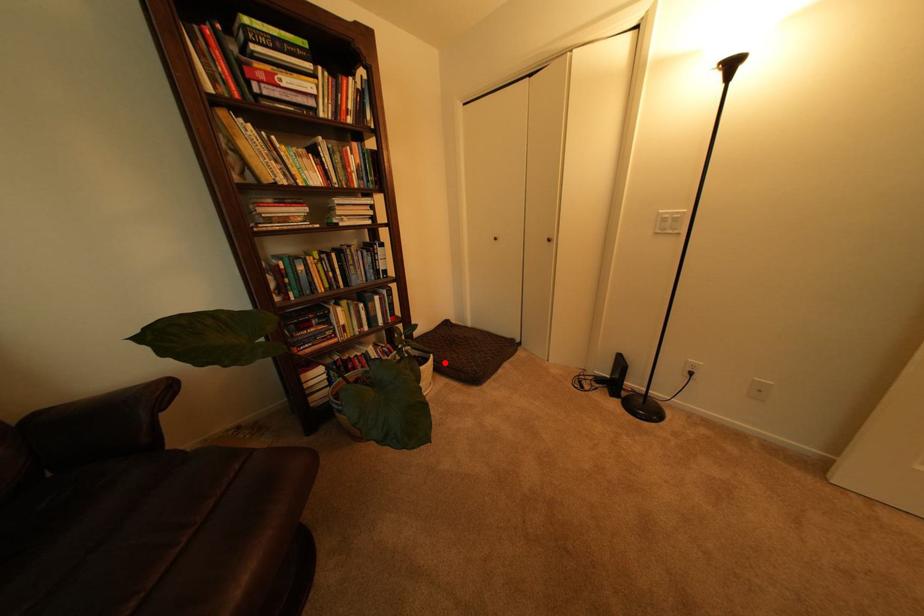
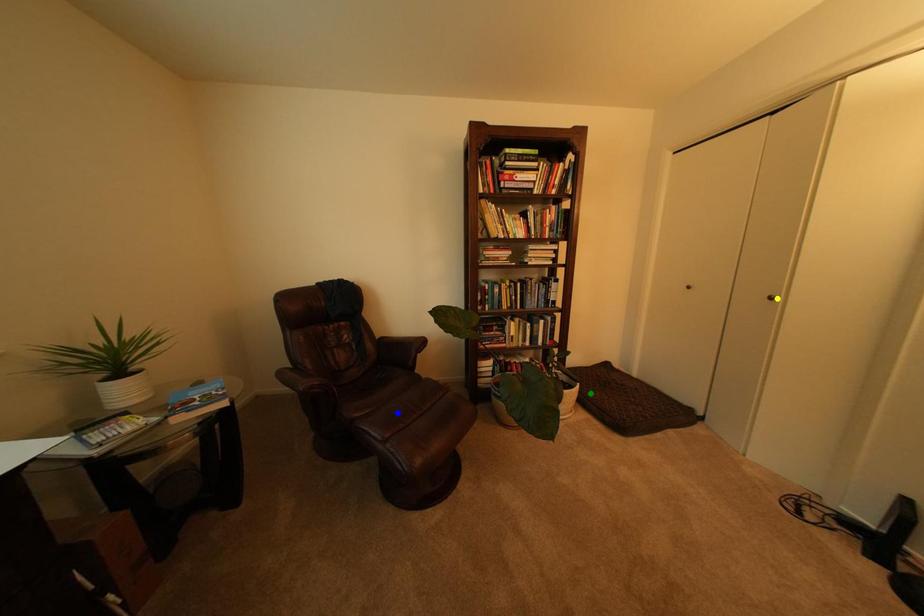
Question: I am providing you with two images of the same scene from different viewpoints. A red point is marked on the first image. You are given multiple points on the second image. Which spot in image 2 lines up with the point in image 1?

Choices:
 (A) yellow point
 (B) blue point
 (C) green point

Answer: (C)